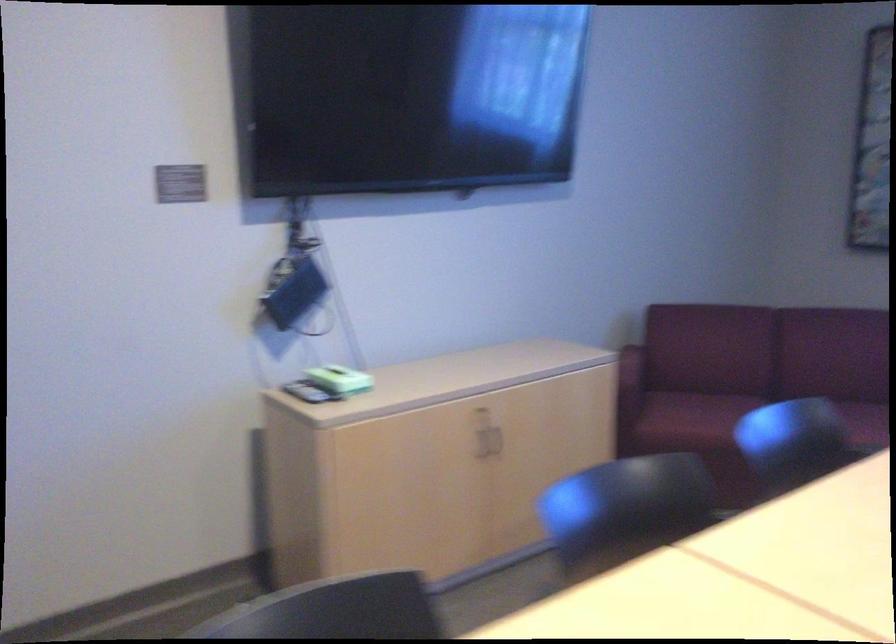
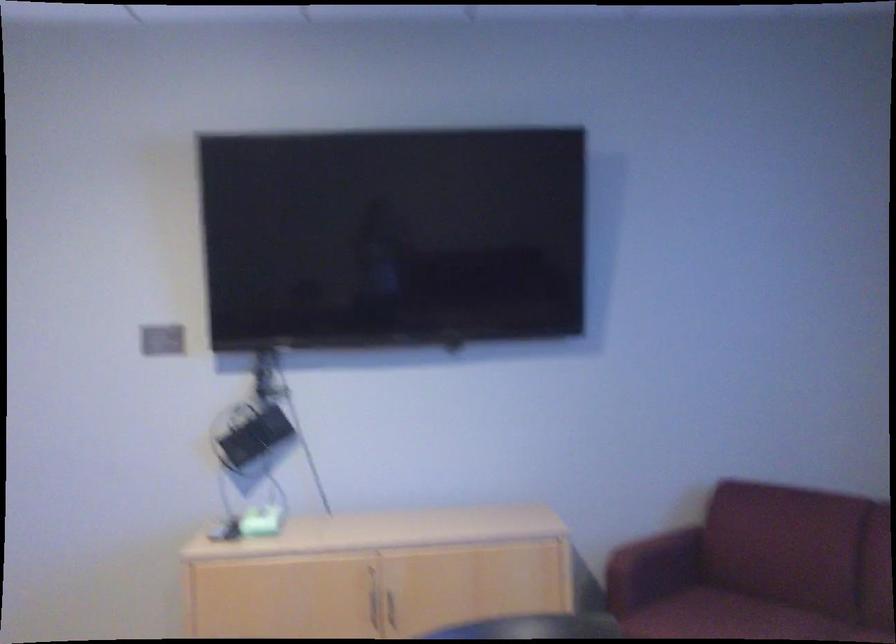
In the second image, find the point that corresponds to (x=641, y=381) in the first image.

(652, 567)